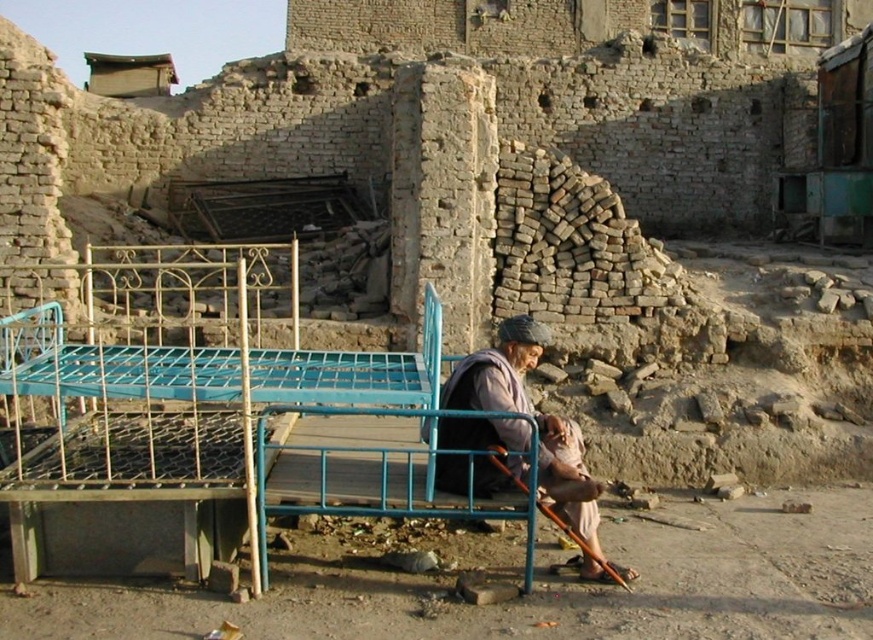
You are standing at the origin point in the image. You see a blue metal bed at center and a point marked at coordinate (172, 380). Is the point located on the blue metal bed at center?

Yes, the point marked at coordinate (172, 380) is located on the blue metal bed at center according to the description.

You are a traveler passing by the blue metal bed at center and the light brown fabric at center. Which object is placed on top of the other?

The blue metal bed at center is positioned over light brown fabric at center, so the blue metal bed at center is placed on top of the light brown fabric at center.